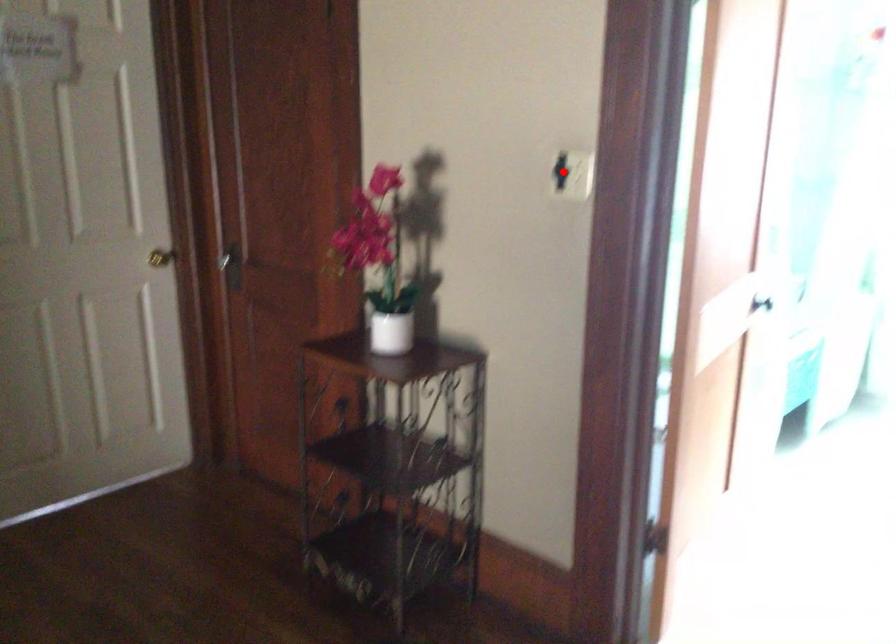
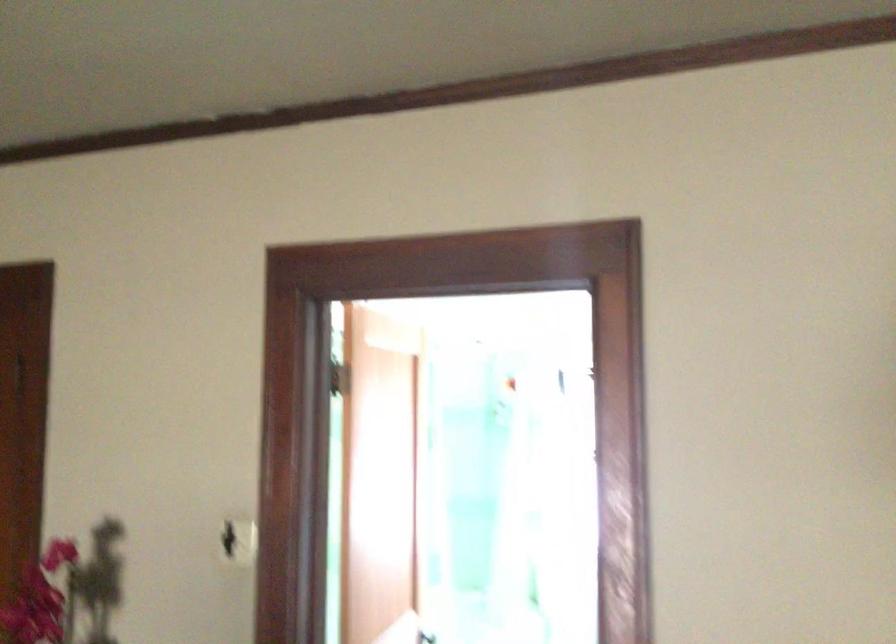
Question: I am providing you with two images of the same scene from different viewpoints. Image1 has a red point marked. In image2, the corresponding 3D location appears at what relative position? Reply with the corresponding letter.

Choices:
 (A) Closer
 (B) Farther

Answer: (B)